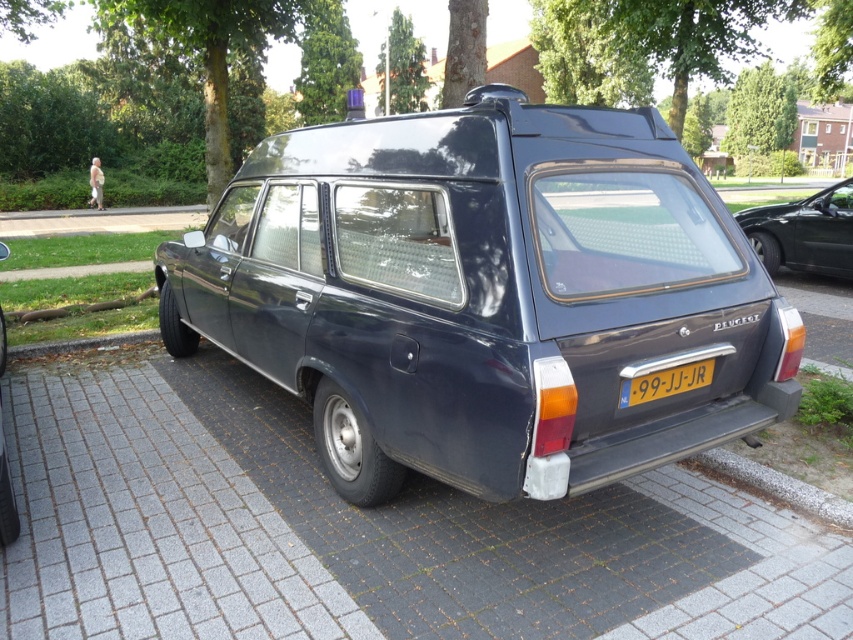
You are standing at the origin point of a coordinate system where the image is mapped. The origin is at the bottom left corner of the image. The coordinates are normalized between 0 and 1. You need to locate the matte black minivan at center. What are its coordinates?

The coordinates of the matte black minivan at center are at point (486,296).

You are a photographer trying to capture the matte black car at right and the yellow metallic license plate at center in a single frame. Since you want to emphasize the size difference between them, which object should you position closer to the camera to achieve this effect?

To emphasize the size difference between the matte black car at right and the yellow metallic license plate at center, you should position the matte black car at right closer to the camera since it is larger in size than the yellow metallic license plate at center.